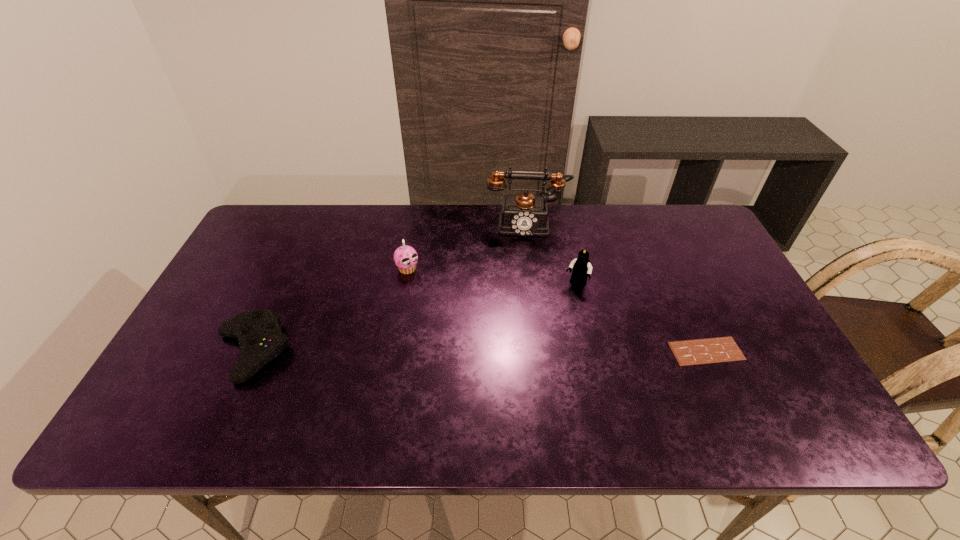
Locate an element on the screen. The width and height of the screenshot is (960, 540). free space located on the face of the fourth object from right to left is located at coordinates (427, 289).

Identify the location of vacant space located 0.130m on the face of the fourth object from right to left. Image resolution: width=960 pixels, height=540 pixels. (440, 301).

Locate an element on the screen. This screenshot has width=960, height=540. vacant area situated on the face of the fourth object from right to left is located at coordinates (491, 353).

At what (x,y) coordinates should I click in order to perform the action: click on vacant space situated on the front-facing side of the Lego. Please return your answer as a coordinate pair (x, y). Looking at the image, I should click on (560, 314).

You are a GUI agent. You are given a task and a screenshot of the screen. Output one action in this format:
    pyautogui.click(x=<x>, y=<y>)
    Task: Click on the vacant space located on the front-facing side of the Lego
    This screenshot has height=540, width=960.
    Given the screenshot: What is the action you would take?
    coord(516,396)

Image resolution: width=960 pixels, height=540 pixels. What are the coordinates of `blank space located 0.200m on the front-facing side of the Lego` in the screenshot? It's located at (545, 340).

Identify the location of free region located on the front of the farthest object at the rotary dial. (525, 283).

You are a GUI agent. You are given a task and a screenshot of the screen. Output one action in this format:
    pyautogui.click(x=<x>, y=<y>)
    Task: Click on the vacant space located 0.170m on the front of the farthest object at the rotary dial
    The image size is (960, 540).
    Given the screenshot: What is the action you would take?
    click(525, 276)

Identify the location of vacant space positioned 0.390m on the front of the farthest object at the rotary dial. The image size is (960, 540). (526, 335).

The width and height of the screenshot is (960, 540). I want to click on object that is at the far edge, so pyautogui.click(x=524, y=214).